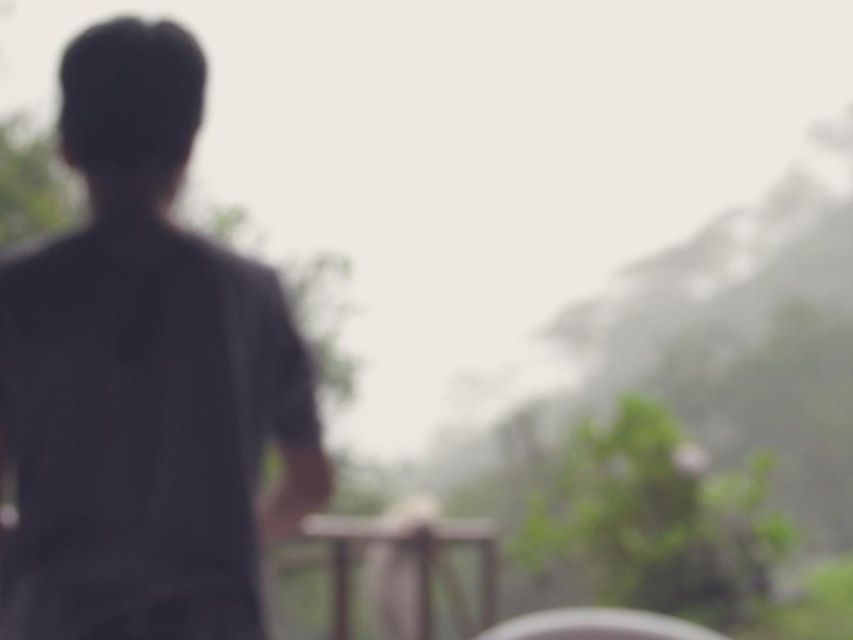
Is dark gray shirt at left to the left of wooden at center from the viewer's perspective?

Indeed, dark gray shirt at left is positioned on the left side of wooden at center.

Who is more distant from viewer, (x=165, y=468) or (x=390, y=524)?

Positioned behind is point (x=390, y=524).

Locate an element on the screen. The image size is (853, 640). dark gray shirt at left is located at coordinates (144, 378).